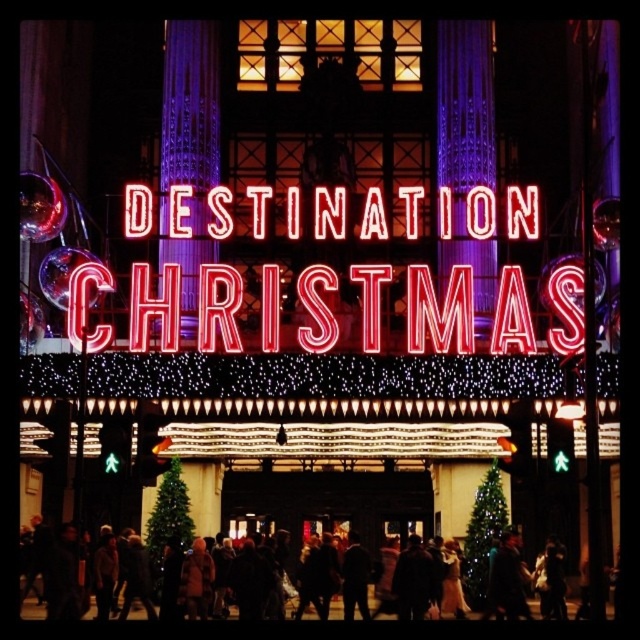
Question: Does dark brown leather jacket at center have a larger size compared to dark brown coat at lower center?

Choices:
 (A) yes
 (B) no

Answer: (B)

Question: Can you confirm if dark brown leather jacket at center is thinner than dark brown coat at lower center?

Choices:
 (A) yes
 (B) no

Answer: (A)

Question: Which point is closer to the camera taking this photo?

Choices:
 (A) (284, 586)
 (B) (484, 570)
 (C) (499, 616)

Answer: (C)

Question: Estimate the real-world distances between objects in this image. Which object is farther from the neon sign at center?

Choices:
 (A) dark brown coat at lower center
 (B) dark brown leather jacket at center

Answer: (B)

Question: Can you confirm if neon sign at center is positioned to the left of dark brown leather jacket at center?

Choices:
 (A) no
 (B) yes

Answer: (B)

Question: Which of the following is the closest to the observer?

Choices:
 (A) (516, 268)
 (B) (339, 534)

Answer: (A)